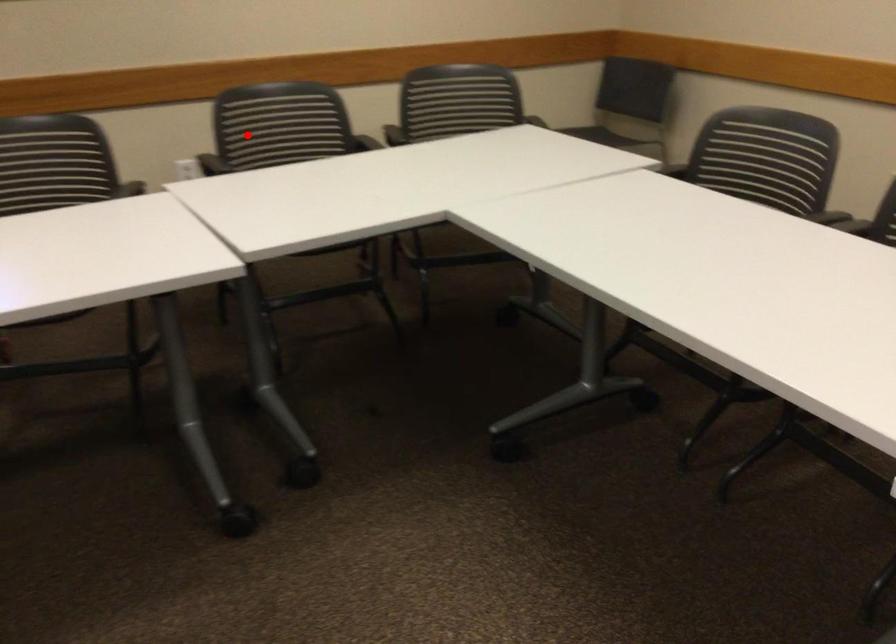
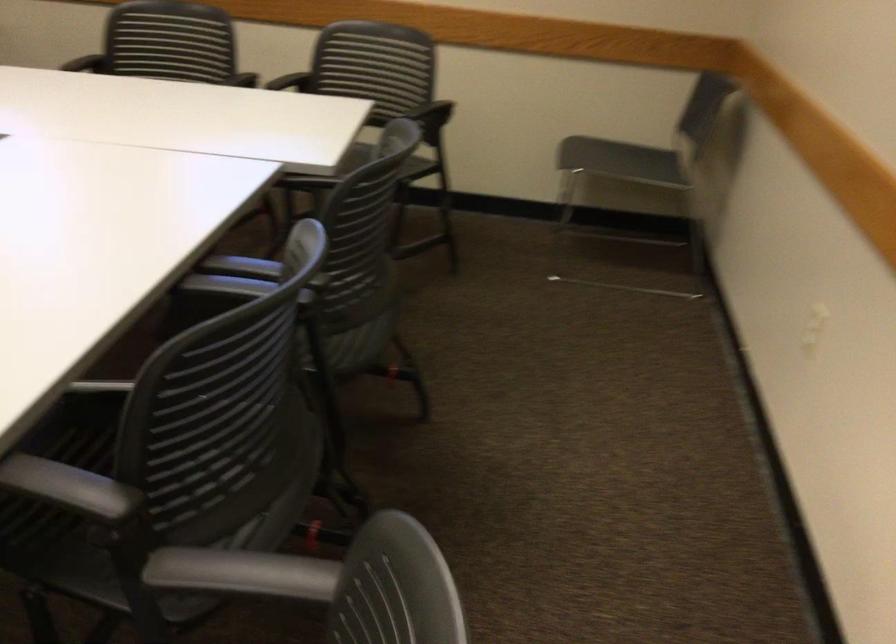
In the second image, find the point that corresponds to the highlighted location in the first image.

(168, 41)